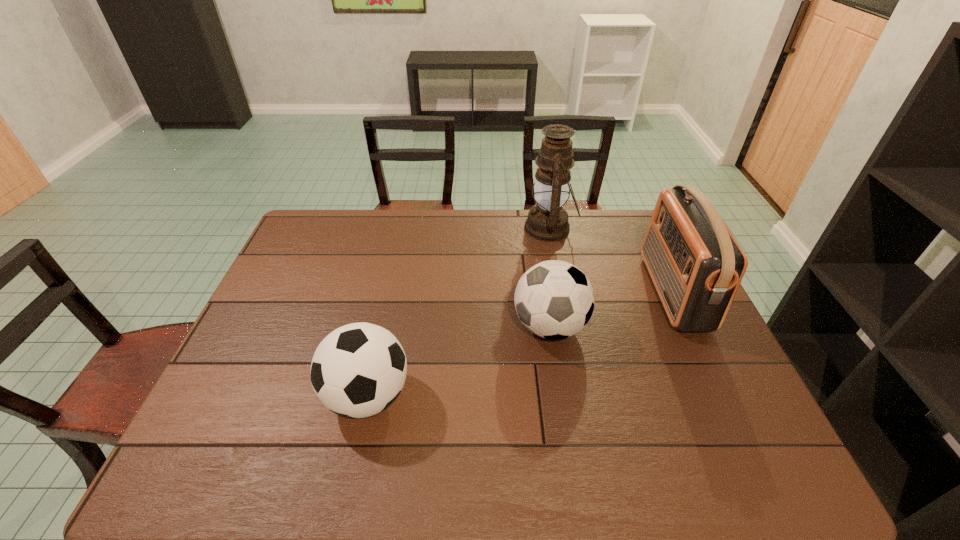
You are a GUI agent. You are given a task and a screenshot of the screen. Output one action in this format:
    pyautogui.click(x=<x>, y=<y>)
    Task: Click on the free region located 0.220m on the front-facing side of the rightmost object
    This screenshot has width=960, height=540.
    Given the screenshot: What is the action you would take?
    [582, 292]

The height and width of the screenshot is (540, 960). In order to click on free spot located 0.330m on the back of the left soccer ball in this screenshot , I will do `click(394, 277)`.

The width and height of the screenshot is (960, 540). What are the coordinates of `vacant point located 0.140m on the main logo of the right soccer ball` in the screenshot? It's located at (464, 326).

Identify the location of free location located on the main logo of the right soccer ball. Image resolution: width=960 pixels, height=540 pixels. (428, 326).

I want to click on vacant region located 0.190m on the main logo of the right soccer ball, so click(x=445, y=326).

Where is `object at the far edge`? This screenshot has height=540, width=960. object at the far edge is located at coordinates (547, 221).

Locate an element on the screen. The height and width of the screenshot is (540, 960). object that is positioned at the right edge is located at coordinates (696, 264).

I want to click on vacant space at the far edge of the desktop, so click(383, 235).

In the image, there is a desktop. At what (x,y) coordinates should I click in order to perform the action: click on vacant space at the near edge. Please return your answer as a coordinate pair (x, y). The width and height of the screenshot is (960, 540). Looking at the image, I should click on (692, 458).

What are the coordinates of `vacant space at the left edge` in the screenshot? It's located at (235, 366).